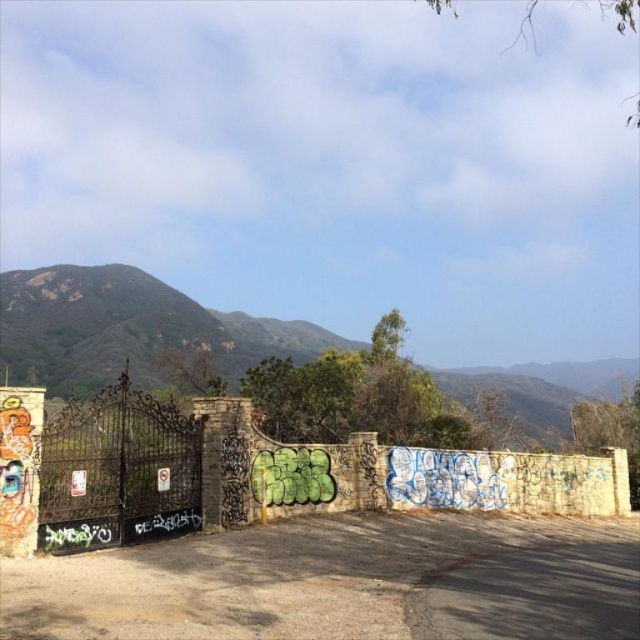
Based on the photo, you are a painter who wants to paint a mural on the stone textured wall at center and the black wrought iron gate at center. Which surface will require more paint because of its larger size?

The stone textured wall at center requires more paint because its width is greater than the black wrought iron gate at center.